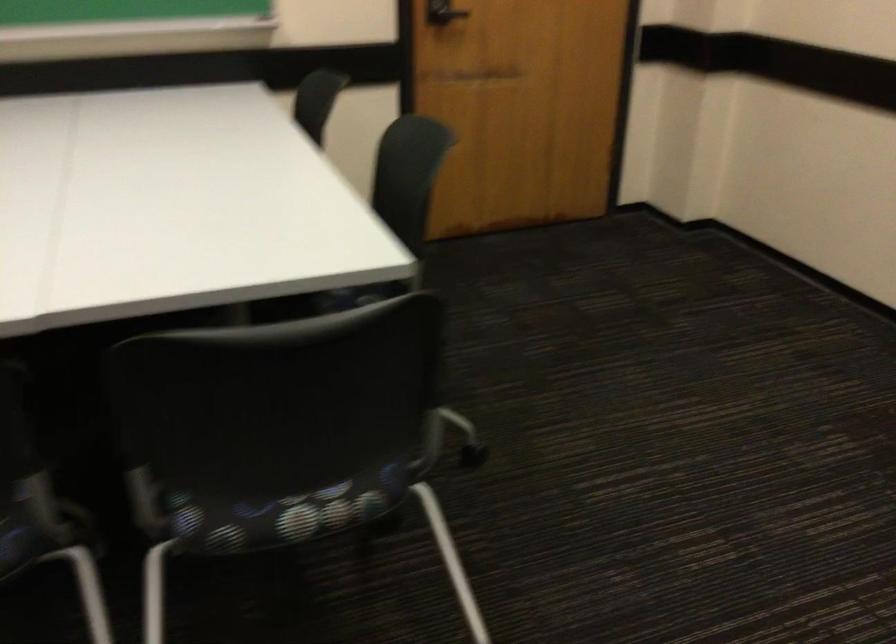
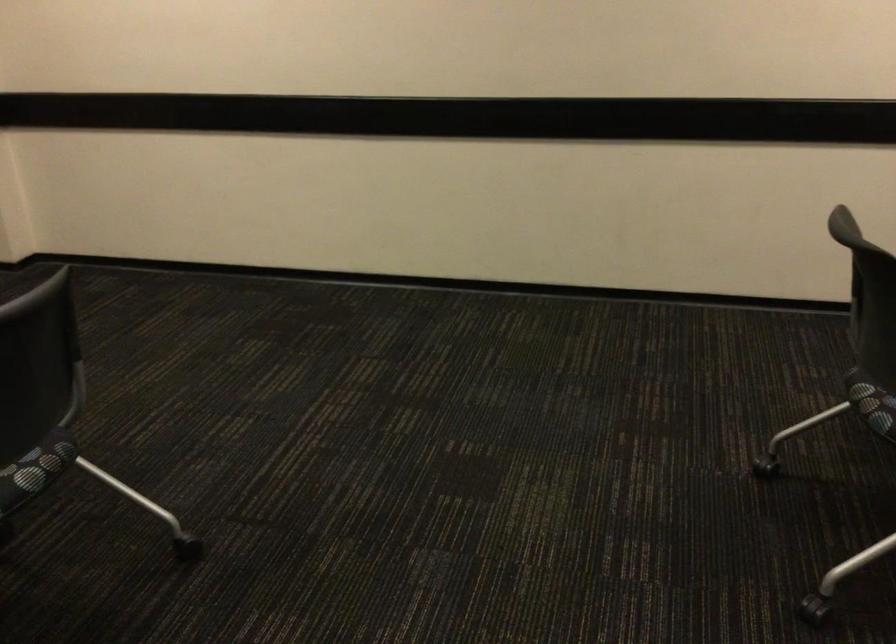
Question: The camera is either moving clockwise (left) or counter-clockwise (right) around the object. The first image is from the beginning of the video and the second image is from the end. Is the camera moving left or right when shooting the video?

Choices:
 (A) Left
 (B) Right

Answer: (A)